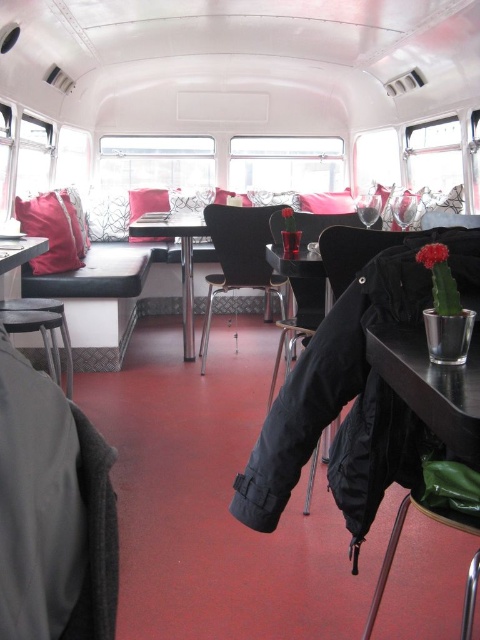
You are sitting in the bus cafe and want to place your wine glass on the closest table. You have the metallic silver table at lower right and the velvet red pillow at left in view. Which object should you place your glass on?

You should place your wine glass on the metallic silver table at lower right because it is positioned to the right of the velvet red pillow at left, making it closer to your current position.

Looking at this image, you are standing inside the bus cafe and want to reach both the point at coordinates point (443, 387) and the point at coordinates point (50, 266). Which point will you reach first as you move forward?

You will reach point (443, 387) first because it is closer to you than point (50, 266).

You are a customer in the bus cafe and want to place your phone on the metallic silver table at lower right without moving from your current position on the matte black pillow at center. Can you reach the table?

The metallic silver table at lower right and matte black pillow at center are 4.99 meters apart from each other. Since the average human arm length is about 0.7 meters, you cannot reach the table from the pillow without moving.